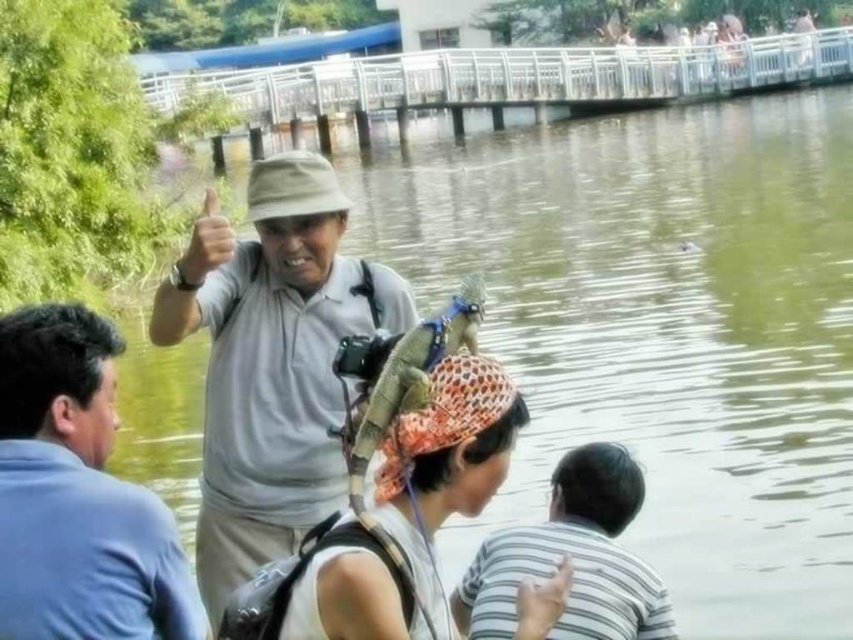
You are standing at the center of the scene and want to take a photo of the blue shirt at left. In which direction should you move to get the best view?

The blue shirt at left is located at point 0.775 on the x and 0.091 on the y coordinates. To get the best view, you should move to the left side of the scene to align with the blue shirt at left.